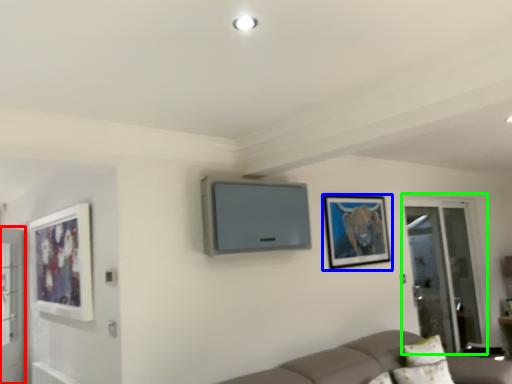
Question: Estimate the real-world distances between objects in this image. Which object is closer to screen door (highlighted by a red box), picture frame (highlighted by a blue box) or screen door (highlighted by a green box)?

Choices:
 (A) picture frame
 (B) screen door

Answer: (A)